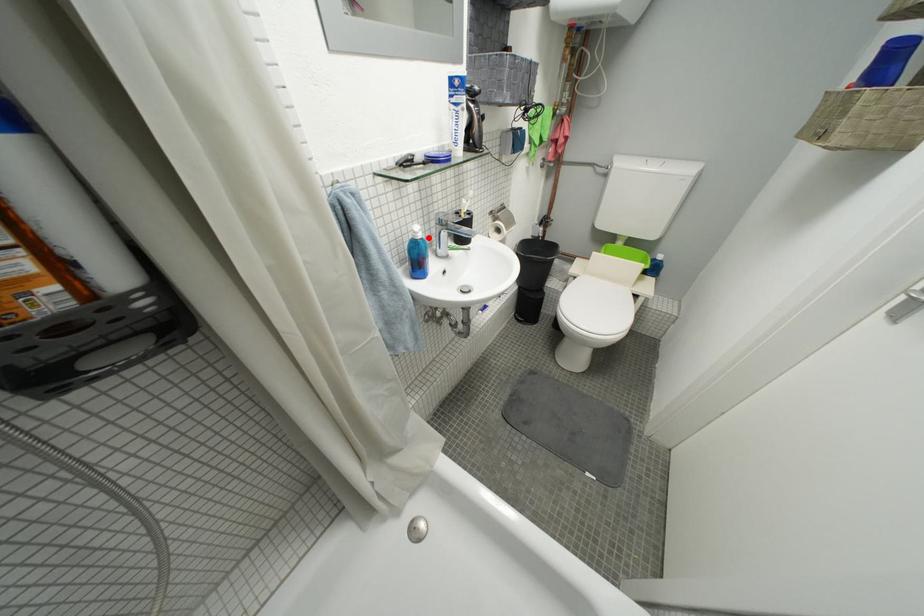
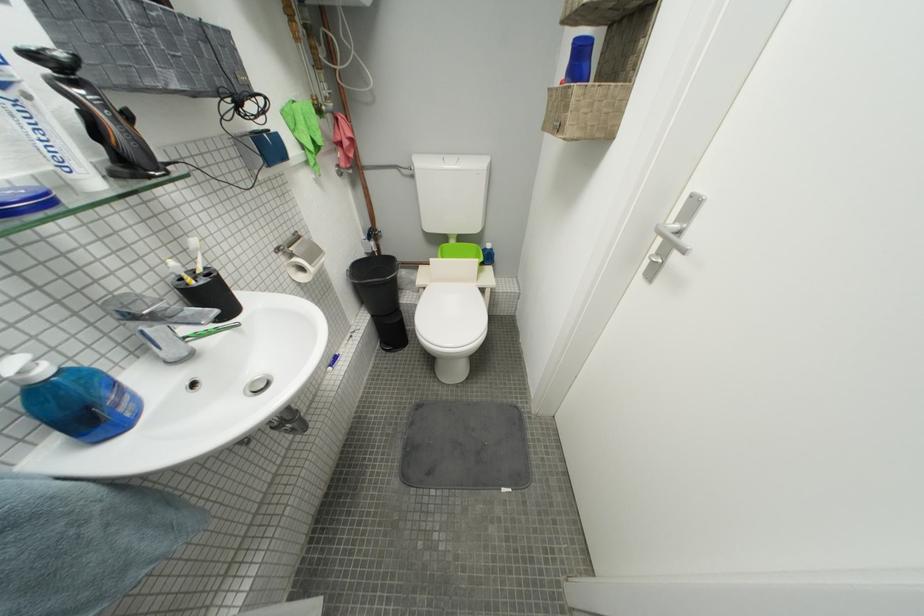
Find the pixel in the second image that matches the highlighted location in the first image.

(53, 374)